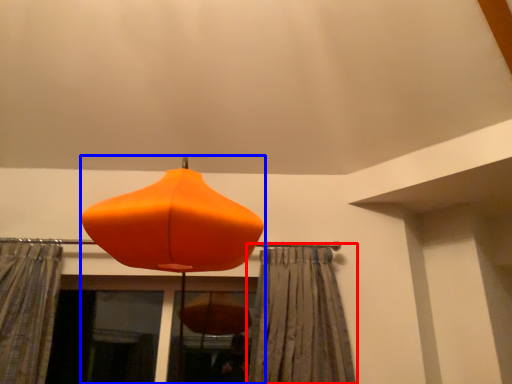
Question: Which point is closer to the camera, curtain (highlighted by a red box) or lamp (highlighted by a blue box)?

Choices:
 (A) curtain
 (B) lamp

Answer: (B)